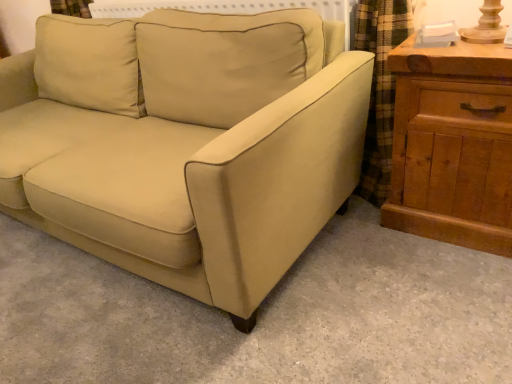
The width and height of the screenshot is (512, 384). Find the location of `free space that is to the left of wooden chest of drawers at right`. free space that is to the left of wooden chest of drawers at right is located at coordinates (364, 244).